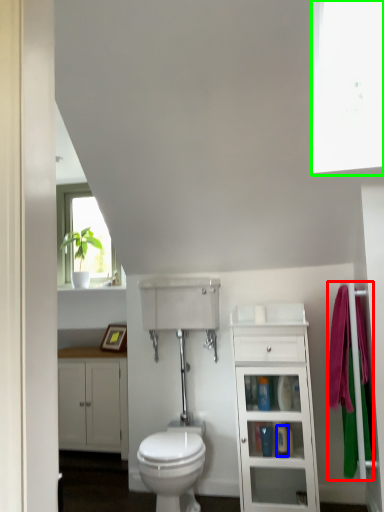
Question: Estimate the real-world distances between objects in this image. Which object is farther from bath towel (highlighted by a red box), toiletry (highlighted by a blue box) or window screen (highlighted by a green box)?

Choices:
 (A) toiletry
 (B) window screen

Answer: (B)